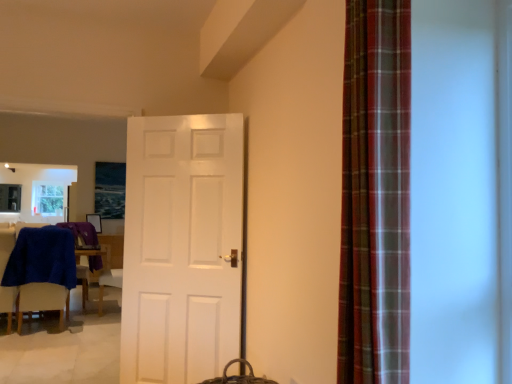
Locate an element on the screen. blue fabric chair at left is located at coordinates (42, 300).

In order to face plaid fabric curtain at right, should I rotate leftwards or rightwards?

You should rotate right by 14.787 degrees.

Measure the distance between white matte door at center and camera.

white matte door at center and camera are 8.99 feet apart.

Where is `blue fabric chair at left`? The image size is (512, 384). blue fabric chair at left is located at coordinates (42, 300).

Is white matte door at center touching plaid fabric curtain at right?

white matte door at center is not next to plaid fabric curtain at right, and they're not touching.

Is white matte door at center inside the boundaries of plaid fabric curtain at right, or outside?

white matte door at center is not inside plaid fabric curtain at right, it's outside.

Where is `curtain located above the white matte door at center (from the image's perspective)`? This screenshot has width=512, height=384. curtain located above the white matte door at center (from the image's perspective) is located at coordinates (375, 195).

Can you confirm if white matte door at center is smaller than plaid fabric curtain at right?

No.

Between blue fabric chair at left and plaid fabric curtain at right, which one has smaller width?

plaid fabric curtain at right.

Relative to plaid fabric curtain at right, is blue fabric chair at left in front or behind?

In the image, blue fabric chair at left appears behind plaid fabric curtain at right.

Considering the sizes of objects blue fabric chair at left and plaid fabric curtain at right in the image provided, who is smaller, blue fabric chair at left or plaid fabric curtain at right?

plaid fabric curtain at right is smaller.

How many degrees apart are the facing directions of blue fabric chair at left and plaid fabric curtain at right?

88.6 degrees.

From a real-world perspective, is plaid fabric curtain at right on blue fabric chair at left?

Yes, from a real-world perspective, plaid fabric curtain at right is above blue fabric chair at left.

From the image's perspective, is plaid fabric curtain at right above or below blue fabric chair at left?

Based on their image positions, plaid fabric curtain at right is located above blue fabric chair at left.

Is there a large distance between plaid fabric curtain at right and blue fabric chair at left?

plaid fabric curtain at right is positioned a significant distance from blue fabric chair at left.

Looking at the image, does plaid fabric curtain at right seem bigger or smaller compared to white matte door at center?

Considering their sizes, plaid fabric curtain at right takes up less space than white matte door at center.

Consider the image. From a real-world perspective, is plaid fabric curtain at right positioned above or below white matte door at center?

plaid fabric curtain at right is above white matte door at center.

Is plaid fabric curtain at right oriented towards white matte door at center?

No, plaid fabric curtain at right is not aimed at white matte door at center.

Locate an element on the screen. door lying below the plaid fabric curtain at right (from the image's perspective) is located at coordinates (182, 248).

Is white matte door at center further to the viewer compared to blue fabric chair at left?

No, white matte door at center is closer to the camera.

Is white matte door at center oriented away from blue fabric chair at left?

No, blue fabric chair at left is not at the back of white matte door at center.

Image resolution: width=512 pixels, height=384 pixels. In order to click on door above the blue fabric chair at left (from the image's perspective) in this screenshot , I will do `click(182, 248)`.

Is white matte door at center completely or partially inside blue fabric chair at left?

Actually, white matte door at center is outside blue fabric chair at left.

From the picture: Between blue fabric chair at left and white matte door at center, which one has larger size?

blue fabric chair at left is bigger.

From the image's perspective, between blue fabric chair at left and white matte door at center, who is located below?

blue fabric chair at left is shown below in the image.

In the scene shown: Would you consider blue fabric chair at left to be distant from white matte door at center?

That's right, there is a large distance between blue fabric chair at left and white matte door at center.

This screenshot has height=384, width=512. I want to click on door behind the plaid fabric curtain at right, so click(182, 248).

Locate an element on the screen. chair below the plaid fabric curtain at right (from the image's perspective) is located at coordinates (42, 300).

Considering their positions, is plaid fabric curtain at right positioned further to blue fabric chair at left than white matte door at center?

plaid fabric curtain at right is positioned further to the anchor blue fabric chair at left.

When comparing their distances from blue fabric chair at left, does white matte door at center or plaid fabric curtain at right seem further?

Based on the image, plaid fabric curtain at right appears to be further to blue fabric chair at left.

Looking at the image, which one is located further to white matte door at center, blue fabric chair at left or plaid fabric curtain at right?

blue fabric chair at left.

Based on their spatial positions, is blue fabric chair at left or white matte door at center further from plaid fabric curtain at right?

blue fabric chair at left is positioned further to the anchor plaid fabric curtain at right.

Considering their positions, is white matte door at center positioned further to plaid fabric curtain at right than blue fabric chair at left?

blue fabric chair at left.

Which object lies further to the anchor point white matte door at center, plaid fabric curtain at right or blue fabric chair at left?

blue fabric chair at left is positioned further to the anchor white matte door at center.

I want to click on door positioned between plaid fabric curtain at right and blue fabric chair at left from near to far, so click(x=182, y=248).